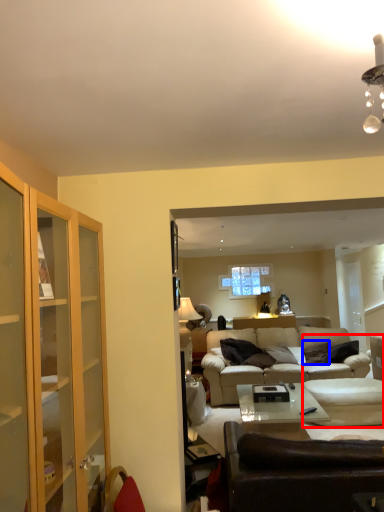
Question: Which object appears farthest to the camera in this image, swivel chair (highlighted by a red box) or pillow (highlighted by a blue box)?

Choices:
 (A) swivel chair
 (B) pillow

Answer: (B)